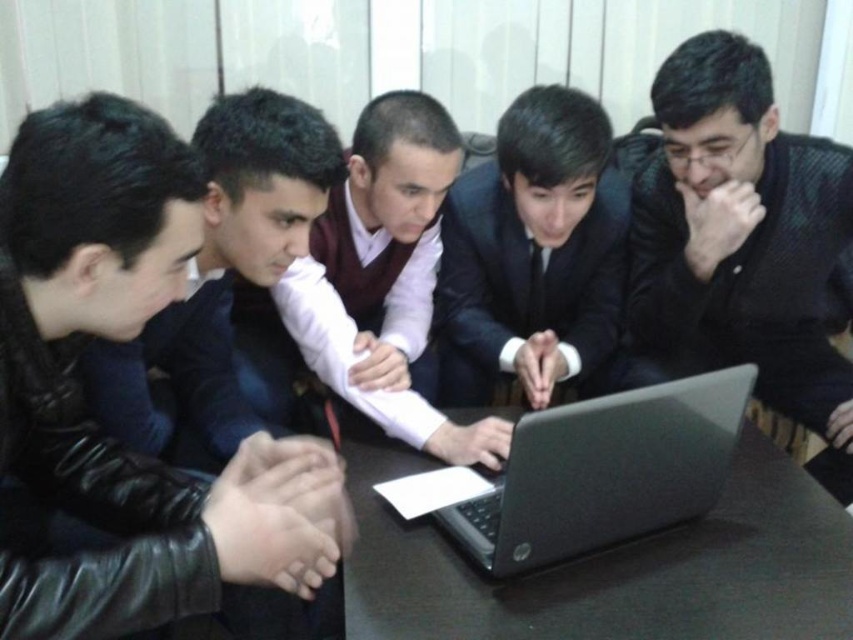
Who is higher up, matte white shirt at center or matte black jacket at left?

matte black jacket at left is above.

Can you confirm if matte white shirt at center is positioned below matte black jacket at left?

Yes, matte white shirt at center is below matte black jacket at left.

Identify the location of matte white shirt at center. The height and width of the screenshot is (640, 853). (384, 276).

Which is above, matte white shirt at center or black matte laptop at center?

matte white shirt at center is higher up.

Between matte white shirt at center and black matte laptop at center, which one has more height?

matte white shirt at center

Who is more forward, (381, 324) or (525, 563)?

Point (525, 563) is more forward.

Where is `matte white shirt at center`? matte white shirt at center is located at coordinates (384, 276).

Based on the photo, is black matte table at center shorter than black leather business suit at lower left?

Yes, black matte table at center is shorter than black leather business suit at lower left.

Can you confirm if black matte table at center is positioned below black leather business suit at lower left?

Correct, black matte table at center is located below black leather business suit at lower left.

Who is more forward, (756,476) or (71,397)?

Point (71,397) is in front.

Image resolution: width=853 pixels, height=640 pixels. Identify the location of black matte table at center. (611, 566).